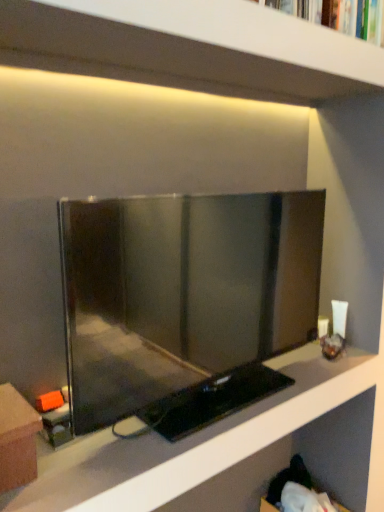
The image size is (384, 512). Identify the location of free spot below matte black tv at center (from a real-world perspective). (235, 400).